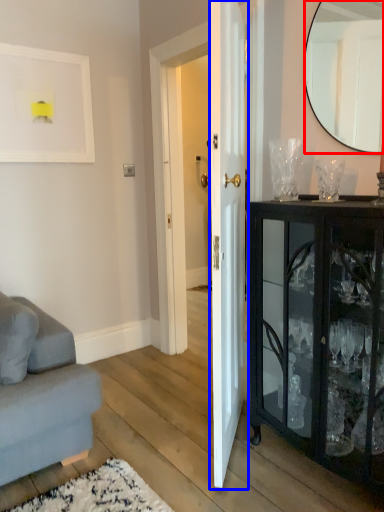
Question: Which object appears farthest to the camera in this image, mirror (highlighted by a red box) or door (highlighted by a blue box)?

Choices:
 (A) mirror
 (B) door

Answer: (A)